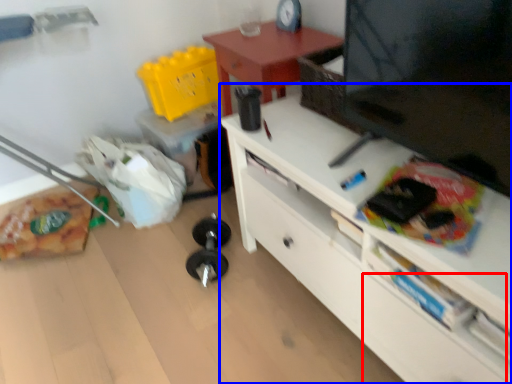
Question: Which point is further to the camera, drawer (highlighted by a red box) or desk (highlighted by a blue box)?

Choices:
 (A) drawer
 (B) desk

Answer: (A)